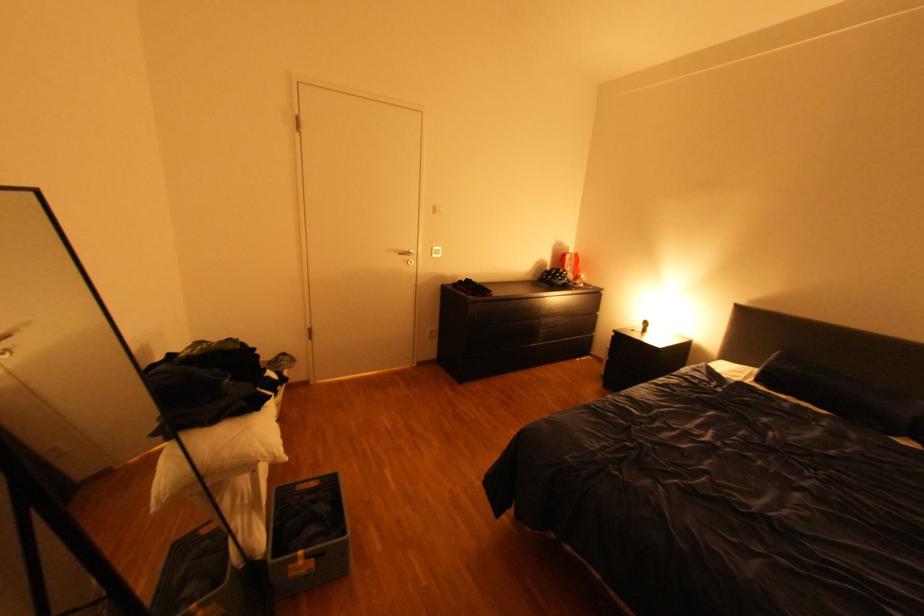
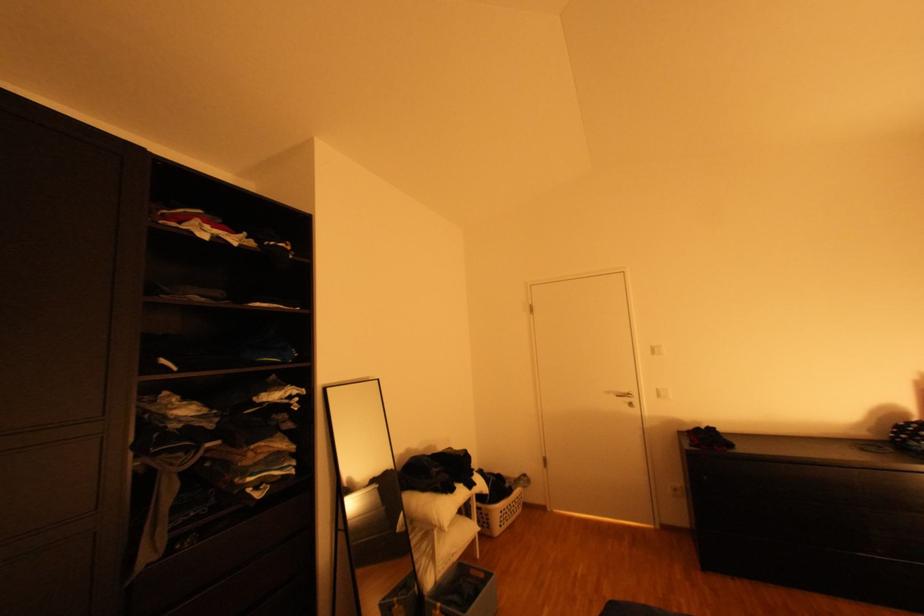
In the second image, find the point that corresponds to point (399, 249) in the first image.

(617, 392)